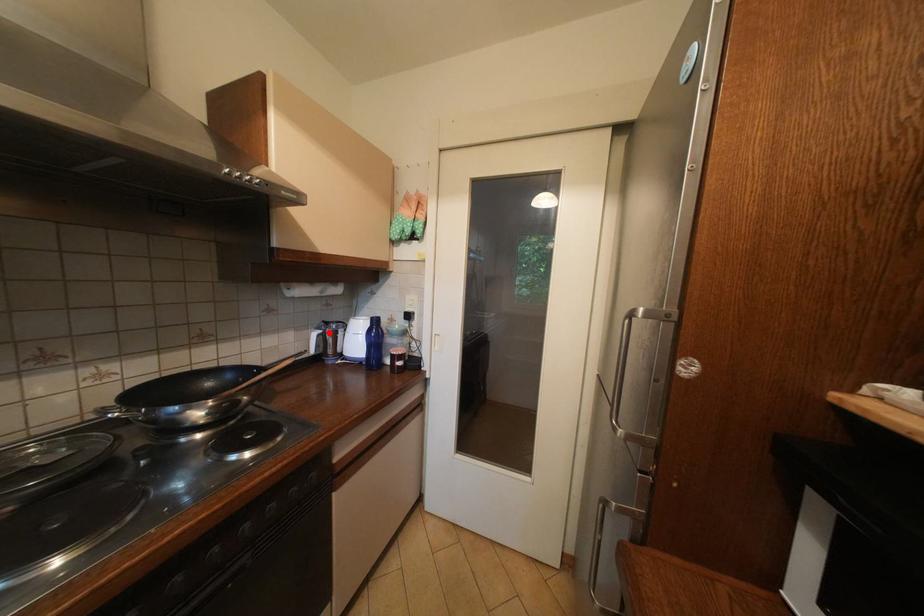
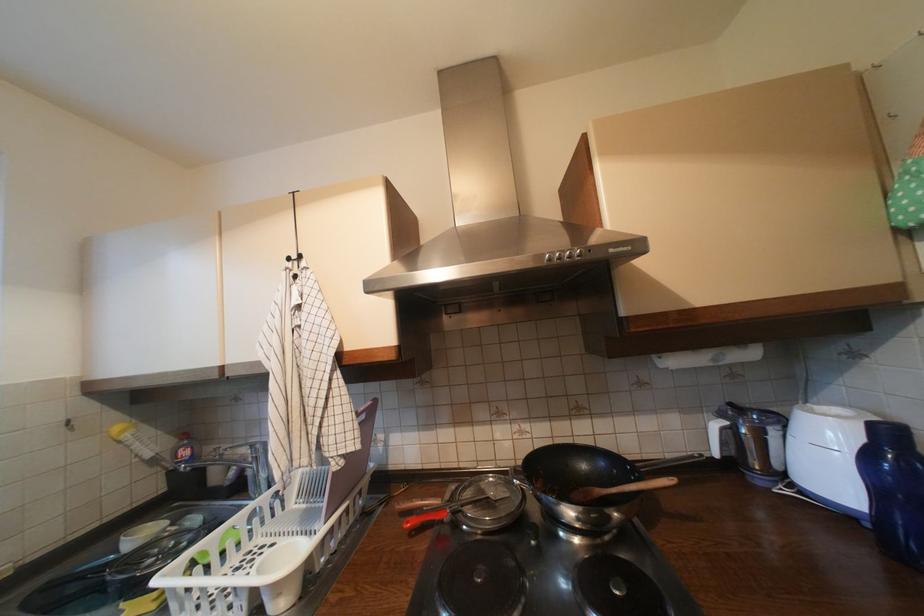
The point at the highlighted location is marked in the first image. Where is the corresponding point in the second image?

(735, 424)